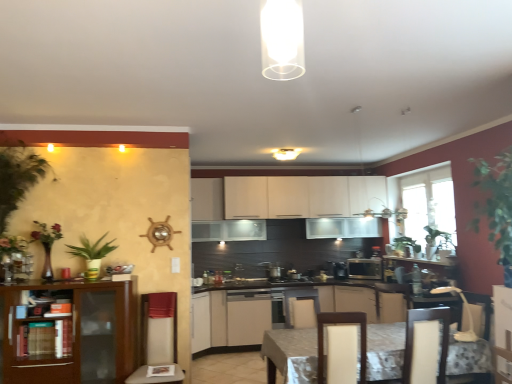
Question: Does transparent glass window at right appear on the right side of matte white cabinets at center, the 2th cabinetry viewed from the front?

Choices:
 (A) yes
 (B) no

Answer: (A)

Question: Is transparent glass window at right located outside matte white cabinets at center, the 4th cabinetry in the back-to-front sequence?

Choices:
 (A) no
 (B) yes

Answer: (B)

Question: Is transparent glass window at right shorter than matte white cabinets at center, the 4th cabinetry in the back-to-front sequence?

Choices:
 (A) no
 (B) yes

Answer: (A)

Question: From a real-world perspective, is transparent glass window at right beneath matte white cabinets at center, the 2th cabinetry viewed from the front?

Choices:
 (A) no
 (B) yes

Answer: (A)

Question: Considering the relative positions of transparent glass window at right and matte white cabinets at center, the 2th cabinetry viewed from the front, in the image provided, is transparent glass window at right behind matte white cabinets at center, the 2th cabinetry viewed from the front,?

Choices:
 (A) yes
 (B) no

Answer: (A)

Question: Considering the relative sizes of transparent glass window at right and matte white cabinets at center, the 4th cabinetry in the back-to-front sequence, in the image provided, is transparent glass window at right wider than matte white cabinets at center, the 4th cabinetry in the back-to-front sequence,?

Choices:
 (A) yes
 (B) no

Answer: (B)

Question: Considering the relative positions of light brown wood swivel chair at center, arranged as the 2th swivel chair when viewed from the right, and white glossy cabinets at center, which is the fifth cabinetry in front-to-back order, in the image provided, is light brown wood swivel chair at center, arranged as the 2th swivel chair when viewed from the right, to the left of white glossy cabinets at center, which is the fifth cabinetry in front-to-back order, from the viewer's perspective?

Choices:
 (A) yes
 (B) no

Answer: (B)

Question: Is white glossy cabinets at center, positioned as the 1th cabinetry in back-to-front order, inside light brown wood swivel chair at center, arranged as the 2th swivel chair when viewed from the right?

Choices:
 (A) yes
 (B) no

Answer: (B)

Question: Is light brown wood swivel chair at center, acting as the second swivel chair starting from the left, not within white glossy cabinets at center, positioned as the 1th cabinetry in back-to-front order?

Choices:
 (A) no
 (B) yes

Answer: (B)

Question: Considering the relative sizes of light brown wood swivel chair at center, acting as the second swivel chair starting from the left, and white glossy cabinets at center, which is the fifth cabinetry in front-to-back order, in the image provided, is light brown wood swivel chair at center, acting as the second swivel chair starting from the left, taller than white glossy cabinets at center, which is the fifth cabinetry in front-to-back order,?

Choices:
 (A) yes
 (B) no

Answer: (B)

Question: Considering the relative positions of light brown wood swivel chair at center, acting as the second swivel chair starting from the left, and white glossy cabinets at center, which is the fifth cabinetry in front-to-back order, in the image provided, is light brown wood swivel chair at center, acting as the second swivel chair starting from the left, to the right of white glossy cabinets at center, which is the fifth cabinetry in front-to-back order, from the viewer's perspective?

Choices:
 (A) no
 (B) yes

Answer: (B)

Question: Does light brown wood swivel chair at center, acting as the second swivel chair starting from the left, have a smaller size compared to white glossy cabinets at center, which is the fifth cabinetry in front-to-back order?

Choices:
 (A) yes
 (B) no

Answer: (A)

Question: Does white glossy cabinet at center, acting as the 1th cabinetry starting from the front, have a lesser width compared to black matte stove at center?

Choices:
 (A) yes
 (B) no

Answer: (A)